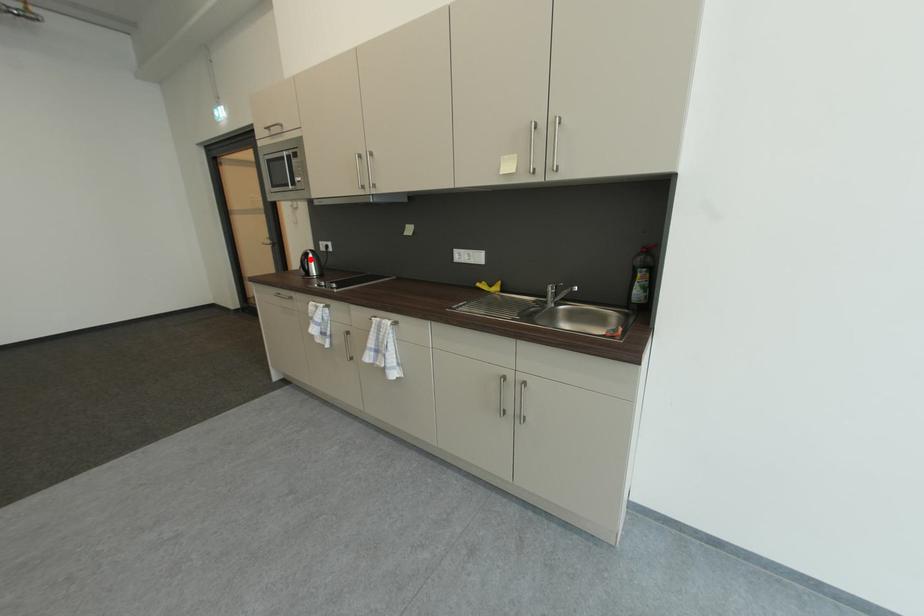
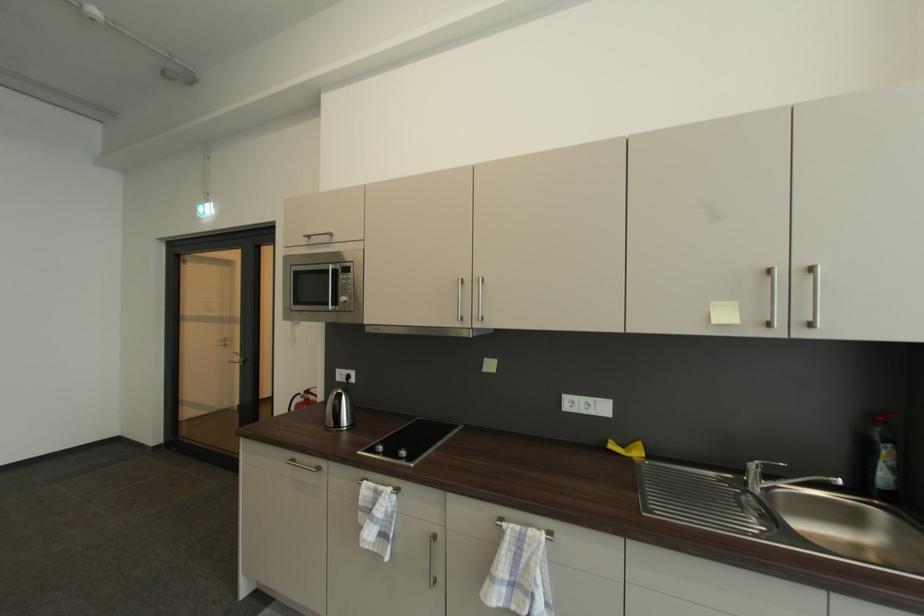
Question: I am providing you with two images of the same scene from different viewpoints. A red point is shown in image1. For the corresponding object point in image2, is it positioned nearer or farther from the camera?

Choices:
 (A) Nearer
 (B) Farther

Answer: (B)